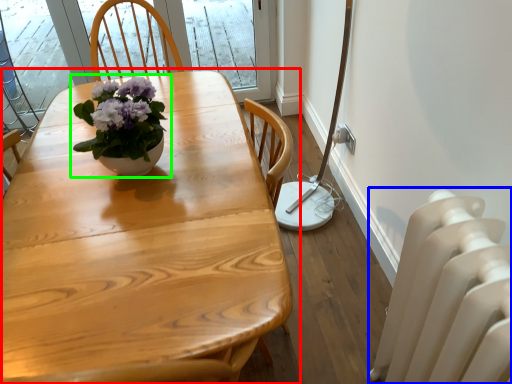
Question: Estimate the real-world distances between objects in this image. Which object is farther from table (highlighted by a red box), radiator (highlighted by a blue box) or houseplant (highlighted by a green box)?

Choices:
 (A) radiator
 (B) houseplant

Answer: (A)